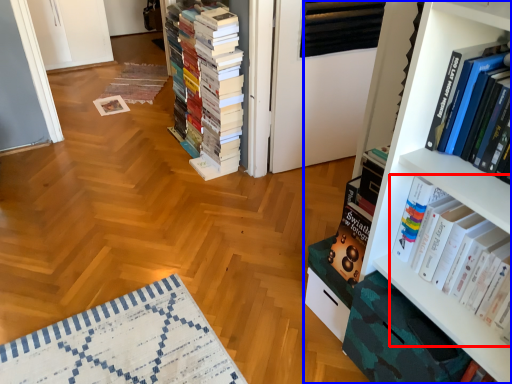
Question: Which of the following is the farthest to the observer, book (highlighted by a red box) or bookcase (highlighted by a blue box)?

Choices:
 (A) book
 (B) bookcase

Answer: (B)